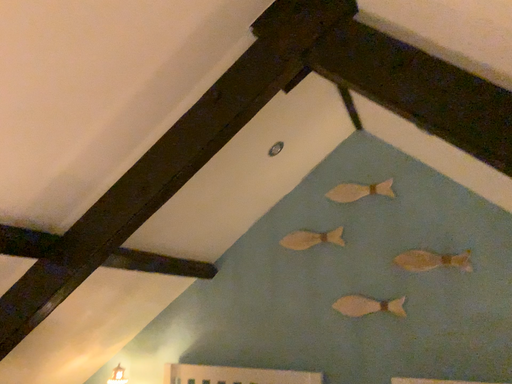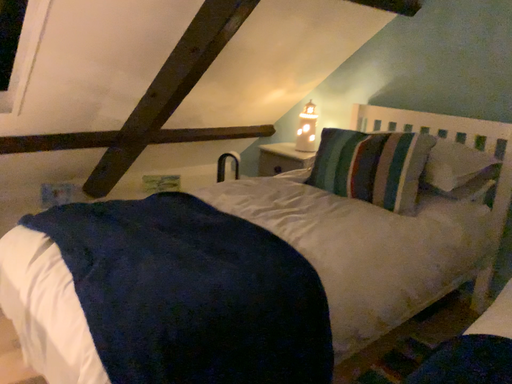
Question: Which way did the camera rotate in the video?

Choices:
 (A) rotated left
 (B) rotated right

Answer: (A)